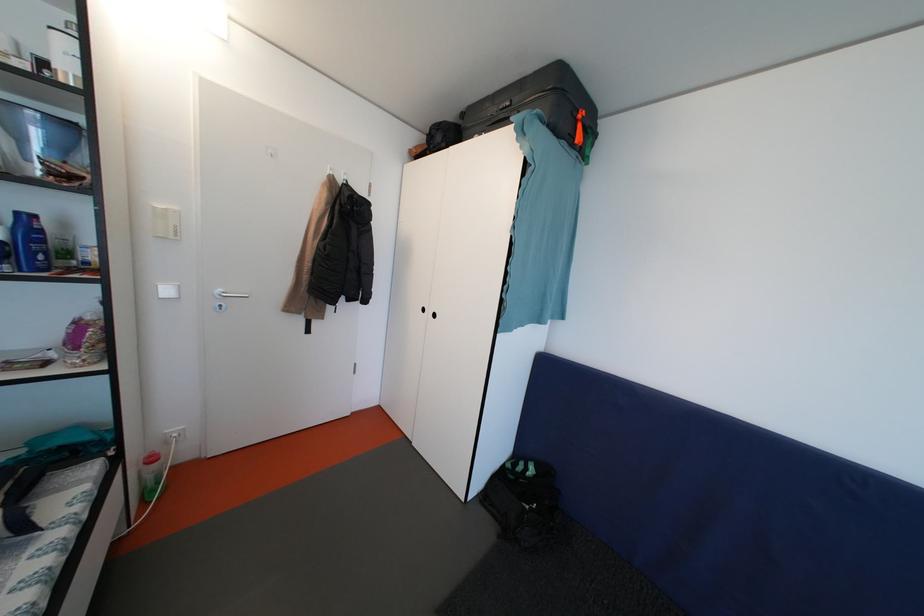
Where would you hang the white door hook? Please return your answer as a coordinate pair (x, y).

(227, 294)